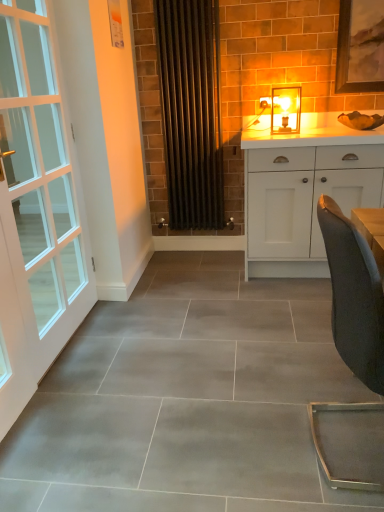
Question: Is white matte cabinet at right to the left of black metal radiator at center from the viewer's perspective?

Choices:
 (A) yes
 (B) no

Answer: (B)

Question: Is white matte cabinet at right touching black metal radiator at center?

Choices:
 (A) no
 (B) yes

Answer: (A)

Question: Considering the relative sizes of white matte cabinet at right and black metal radiator at center in the image provided, is white matte cabinet at right wider than black metal radiator at center?

Choices:
 (A) no
 (B) yes

Answer: (B)

Question: Is white matte cabinet at right facing towards black metal radiator at center?

Choices:
 (A) no
 (B) yes

Answer: (A)

Question: Does white matte cabinet at right have a smaller size compared to black metal radiator at center?

Choices:
 (A) no
 (B) yes

Answer: (A)

Question: Can you confirm if white matte cabinet at right is thinner than black metal radiator at center?

Choices:
 (A) no
 (B) yes

Answer: (A)

Question: Is white glass door at left wider than white matte cabinet at right?

Choices:
 (A) no
 (B) yes

Answer: (A)

Question: Considering the relative sizes of white glass door at left and white matte cabinet at right in the image provided, is white glass door at left smaller than white matte cabinet at right?

Choices:
 (A) yes
 (B) no

Answer: (A)

Question: Would you say white glass door at left is outside white matte cabinet at right?

Choices:
 (A) yes
 (B) no

Answer: (A)

Question: Is white glass door at left thinner than white matte cabinet at right?

Choices:
 (A) no
 (B) yes

Answer: (B)

Question: Are white glass door at left and white matte cabinet at right beside each other?

Choices:
 (A) yes
 (B) no

Answer: (B)

Question: Is white glass door at left far from white matte cabinet at right?

Choices:
 (A) no
 (B) yes

Answer: (B)

Question: Is black metal radiator at center positioned in front of white matte cabinet at right?

Choices:
 (A) yes
 (B) no

Answer: (B)